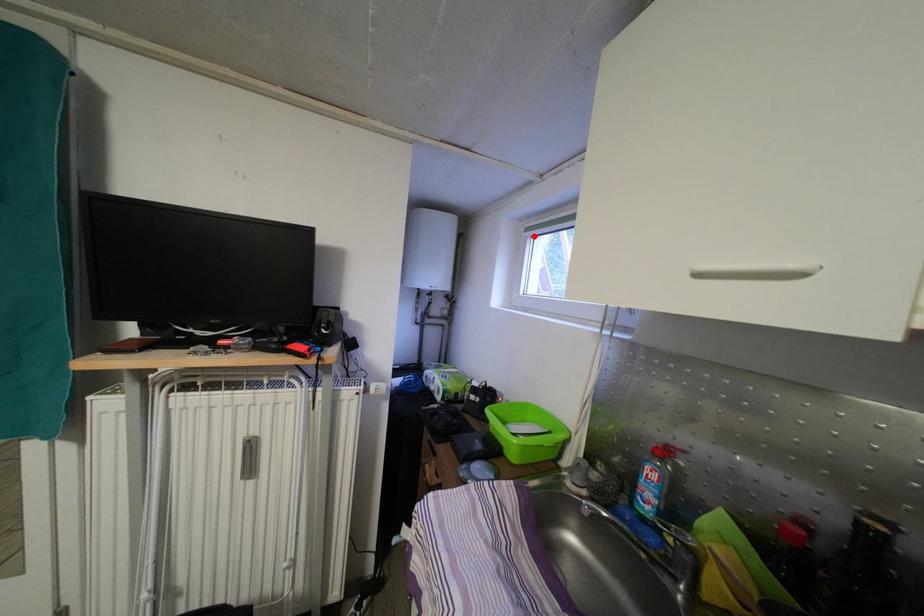
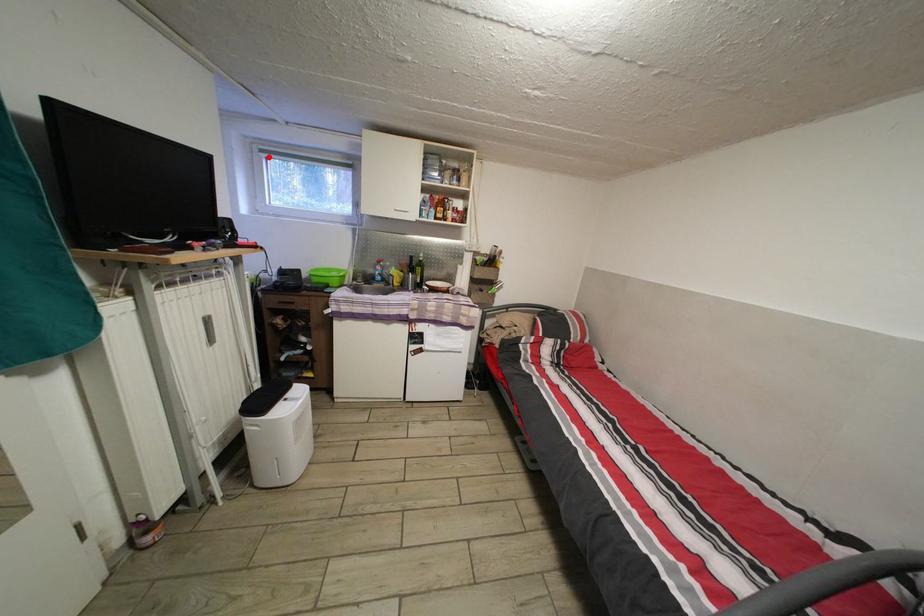
I am providing you with two images of the same scene from different viewpoints. A red point is marked on the first image and another point is marked on the second image. Does the point marked in image1 correspond to the same location as the one in image2?

Yes